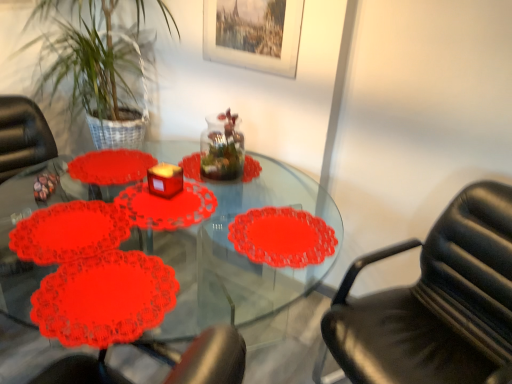
Question: Is lacy paper doily at lower left oriented towards matte red candle at center?

Choices:
 (A) no
 (B) yes

Answer: (A)

Question: Is lacy paper doily at lower left with matte red candle at center?

Choices:
 (A) no
 (B) yes

Answer: (A)

Question: Is lacy paper doily at lower left outside of matte red candle at center?

Choices:
 (A) no
 (B) yes

Answer: (B)

Question: From a real-world perspective, is lacy paper doily at lower left located higher than matte red candle at center?

Choices:
 (A) yes
 (B) no

Answer: (B)

Question: Can you confirm if lacy paper doily at lower left is smaller than matte red candle at center?

Choices:
 (A) no
 (B) yes

Answer: (A)

Question: Is lacy paper doily at lower left taller than matte red candle at center?

Choices:
 (A) no
 (B) yes

Answer: (A)

Question: Considering the relative sizes of matte red candle at center and lacy paper doily at lower left in the image provided, is matte red candle at center wider than lacy paper doily at lower left?

Choices:
 (A) no
 (B) yes

Answer: (A)

Question: Is matte red candle at center positioned beyond the bounds of lacy paper doily at lower left?

Choices:
 (A) yes
 (B) no

Answer: (A)

Question: From the image's perspective, is matte red candle at center located beneath lacy paper doily at lower left?

Choices:
 (A) yes
 (B) no

Answer: (B)

Question: Considering the relative sizes of matte red candle at center and lacy paper doily at lower left in the image provided, is matte red candle at center shorter than lacy paper doily at lower left?

Choices:
 (A) yes
 (B) no

Answer: (B)

Question: Is matte red candle at center bigger than lacy paper doily at lower left?

Choices:
 (A) no
 (B) yes

Answer: (A)

Question: From a real-world perspective, is matte red candle at center below lacy paper doily at lower left?

Choices:
 (A) no
 (B) yes

Answer: (A)

Question: Is wooden picture frame at upper center in front of matte red candle at center?

Choices:
 (A) yes
 (B) no

Answer: (B)